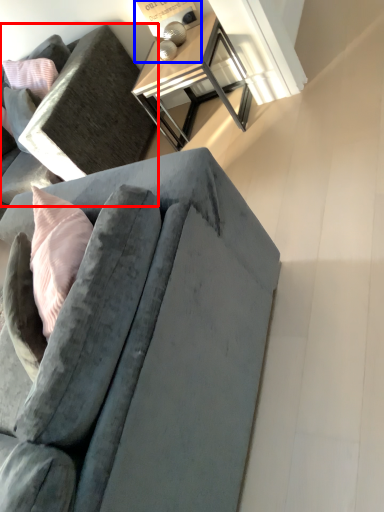
Question: Which object appears closest to the camera in this image, studio couch (highlighted by a red box) or table lamp (highlighted by a blue box)?

Choices:
 (A) studio couch
 (B) table lamp

Answer: (A)